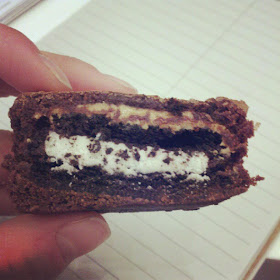
The height and width of the screenshot is (280, 280). I want to click on table, so (271, 257).